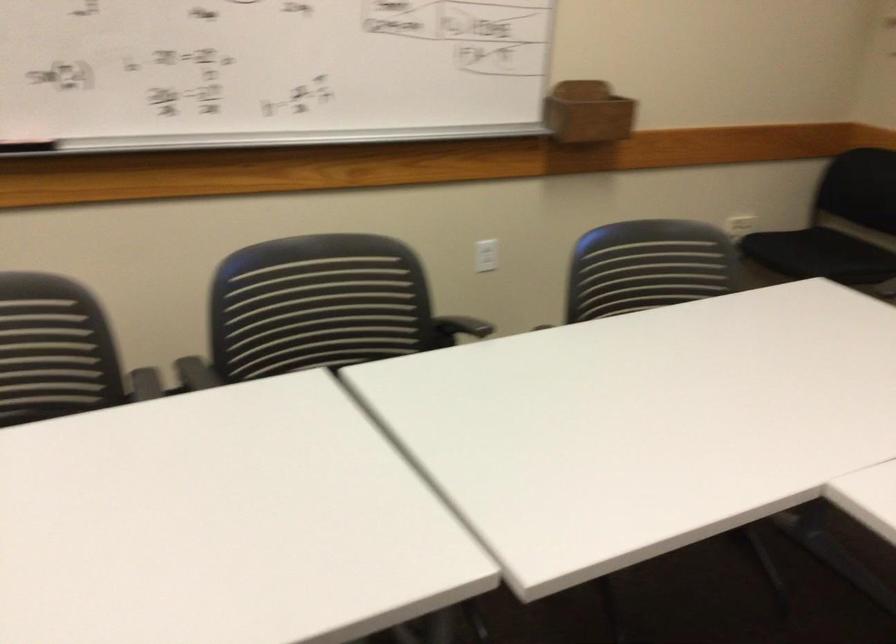
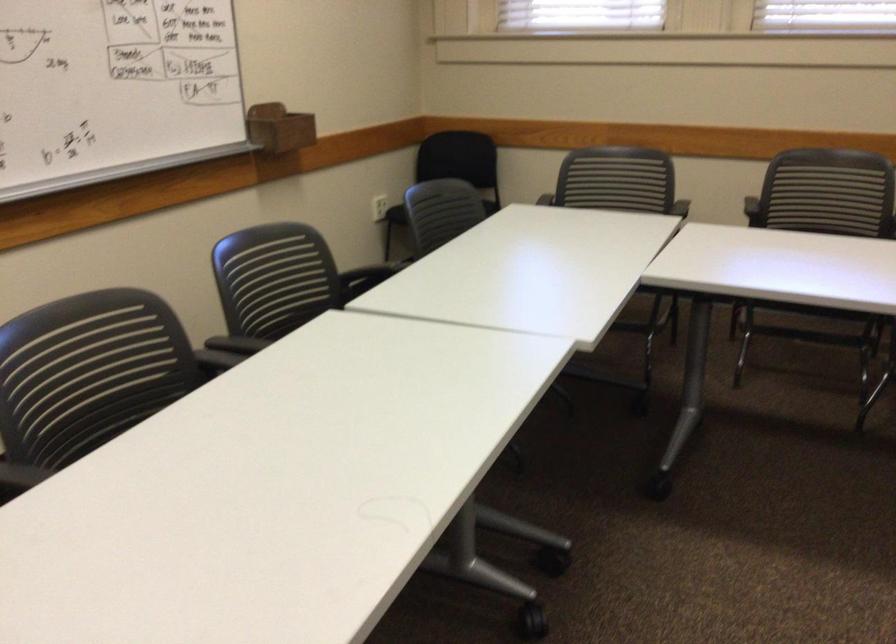
Locate, in the second image, the point that corresponds to point (76, 372) in the first image.

(125, 375)